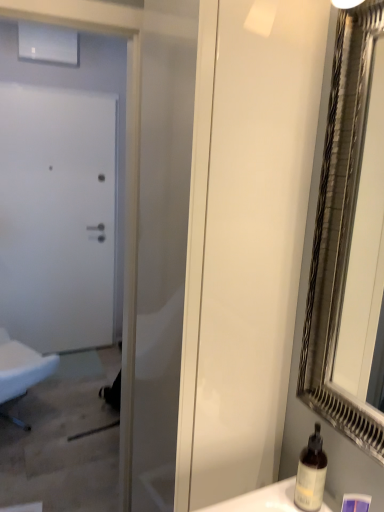
The width and height of the screenshot is (384, 512). Identify the location of free point in front of white fabric chair at left. (38, 463).